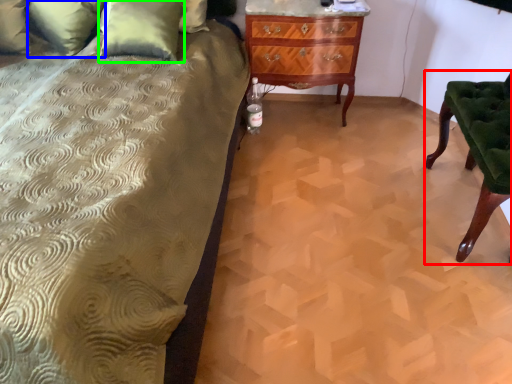
Question: Based on their relative distances, which object is nearer to furniture (highlighted by a red box)? Choose from pillow (highlighted by a blue box) and pillow (highlighted by a green box).

Choices:
 (A) pillow
 (B) pillow

Answer: (B)